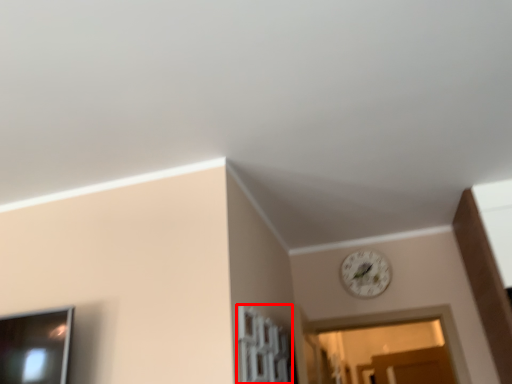
Question: From the image's perspective, what is the correct spatial relationship of window (annotated by the red box) in relation to clock?

Choices:
 (A) above
 (B) below

Answer: (B)